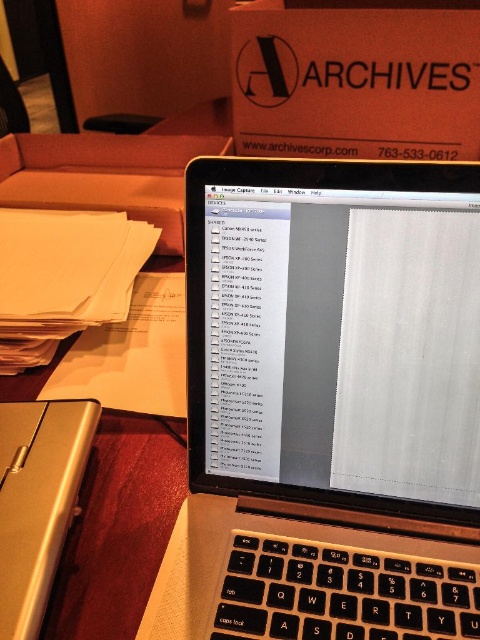
Is the position of silver/black laptop at center less distant than that of silver metallic case at lower left?

No, it is not.

Can you confirm if silver/black laptop at center is shorter than silver metallic case at lower left?

In fact, silver/black laptop at center may be taller than silver metallic case at lower left.

Who is more forward, (195,244) or (57,544)?

Positioned in front is point (57,544).

This screenshot has height=640, width=480. Find the location of `silver/black laptop at center`. silver/black laptop at center is located at coordinates (327, 404).

Is point (290, 90) closer to camera compared to point (81, 406)?

No, it is not.

Is the position of matte black cardboard box at upper center more distant than that of silver metallic case at lower left?

Yes, it is behind silver metallic case at lower left.

Between point (389, 52) and point (24, 548), which one is positioned behind?

Point (389, 52)

This screenshot has width=480, height=640. Identify the location of matte black cardboard box at upper center. (x=356, y=81).

Between silver/black laptop at center and matte black cardboard box at upper center, which one has less height?

matte black cardboard box at upper center

Does point (208, 278) come in front of point (470, 81)?

Yes, it is.

Which is in front, point (292, 324) or point (388, 26)?

Positioned in front is point (292, 324).

Where is `silver/black laptop at center`? This screenshot has height=640, width=480. silver/black laptop at center is located at coordinates (327, 404).